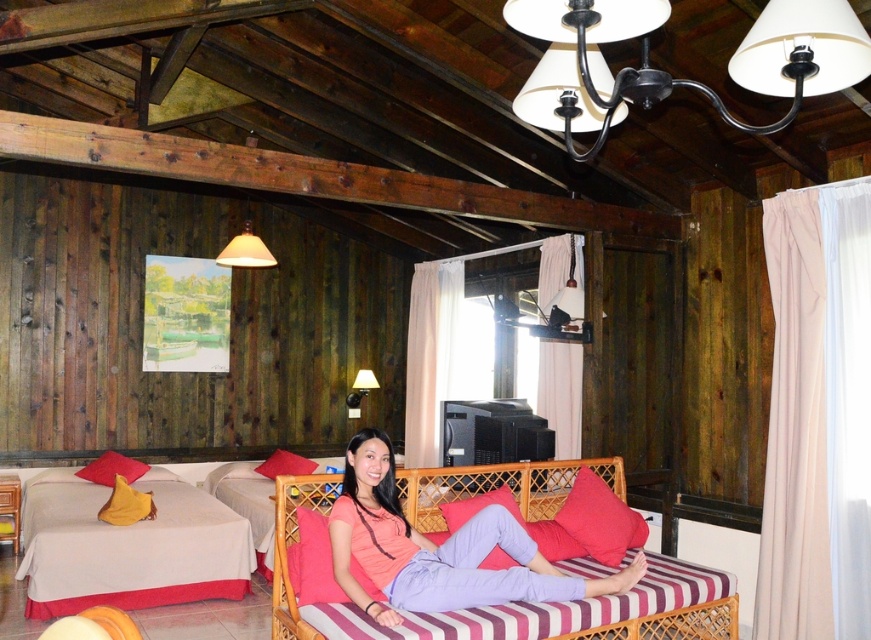
You are standing at the entrance of the cabin and notice two points marked in the image. The first point is at coordinates point (125, 518) and the second is at point (372, 387). Which of these points is closer to you as you face the room?

Point (125, 518) is in front of point (372, 387), so it is closer to you as you face the room.

You are standing at the camera position and want to grab the yellow fabric pillow at lower left. Is it within a 15 feet distance?

The yellow fabric pillow at lower left and camera are 14.91 feet apart, so yes, it is within 15 feet distance.

You are standing in the cabin and want to place a small book on the nearest horizontal surface. Which object between the yellow fabric pillow at lower left and the matte black wall lamp at upper center can you use for this purpose?

The yellow fabric pillow at lower left is located below the matte black wall lamp at upper center and is a horizontal surface, so you can place the book there.